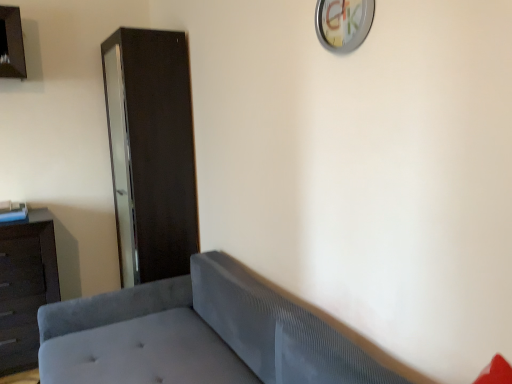
Question: From a real-world perspective, is metallic silver clock at upper center located higher than dark brown wood dresser at left?

Choices:
 (A) yes
 (B) no

Answer: (A)

Question: Is metallic silver clock at upper center closer to camera compared to dark brown wood dresser at left?

Choices:
 (A) no
 (B) yes

Answer: (B)

Question: Could you tell me if metallic silver clock at upper center is facing dark brown wood dresser at left?

Choices:
 (A) yes
 (B) no

Answer: (B)

Question: Is metallic silver clock at upper center wider than dark brown wood dresser at left?

Choices:
 (A) no
 (B) yes

Answer: (A)

Question: Is metallic silver clock at upper center positioned behind dark brown wood dresser at left?

Choices:
 (A) yes
 (B) no

Answer: (B)

Question: From their relative heights in the image, would you say metallic silver clock at upper center is taller or shorter than dark brown wood dresser at left?

Choices:
 (A) tall
 (B) short

Answer: (B)

Question: Considering the positions of point (337, 11) and point (49, 281), is point (337, 11) closer or farther from the camera than point (49, 281)?

Choices:
 (A) farther
 (B) closer

Answer: (B)

Question: In terms of width, does metallic silver clock at upper center look wider or thinner when compared to dark brown wood dresser at left?

Choices:
 (A) wide
 (B) thin

Answer: (B)

Question: In the image, is metallic silver clock at upper center positioned in front of or behind dark brown wood dresser at left?

Choices:
 (A) behind
 (B) front

Answer: (B)

Question: Considering the positions of point (25, 291) and point (218, 357), is point (25, 291) closer or farther from the camera than point (218, 357)?

Choices:
 (A) closer
 (B) farther

Answer: (B)

Question: In the image, is dark brown wood dresser at left positioned in front of or behind velvet gray studio couch at lower left?

Choices:
 (A) behind
 (B) front

Answer: (A)

Question: Is dark brown wood dresser at left taller or shorter than velvet gray studio couch at lower left?

Choices:
 (A) tall
 (B) short

Answer: (A)

Question: Looking at the image, does dark brown wood dresser at left seem bigger or smaller compared to velvet gray studio couch at lower left?

Choices:
 (A) small
 (B) big

Answer: (A)

Question: Visually, is metallic silver clock at upper center positioned to the left or to the right of velvet gray studio couch at lower left?

Choices:
 (A) right
 (B) left

Answer: (A)

Question: From a real-world perspective, is metallic silver clock at upper center above or below velvet gray studio couch at lower left?

Choices:
 (A) above
 (B) below

Answer: (A)